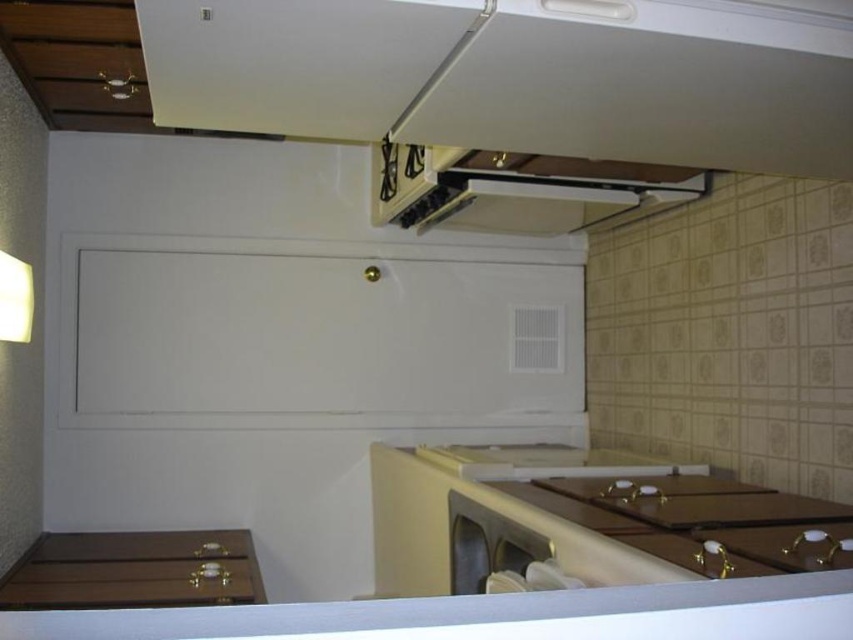
How far apart are white glossy exhaust hood at upper center and satin silver dishwasher at lower center?

A distance of 1.06 meters exists between white glossy exhaust hood at upper center and satin silver dishwasher at lower center.

Is point (577, 188) less distant than point (454, 566)?

No.

This screenshot has width=853, height=640. What do you see at coordinates (509, 189) in the screenshot? I see `white glossy exhaust hood at upper center` at bounding box center [509, 189].

Image resolution: width=853 pixels, height=640 pixels. In order to click on white glossy exhaust hood at upper center in this screenshot , I will do `click(509, 189)`.